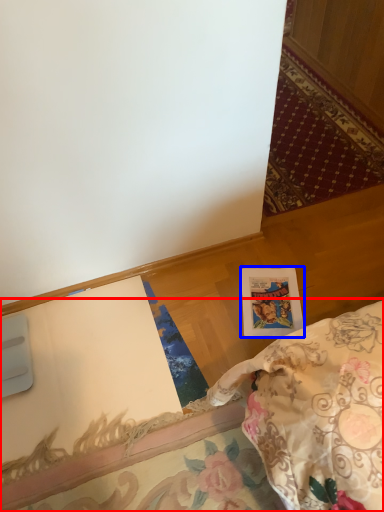
Question: Which of the following is the farthest to the observer, furniture (highlighted by a red box) or postcard (highlighted by a blue box)?

Choices:
 (A) furniture
 (B) postcard

Answer: (B)